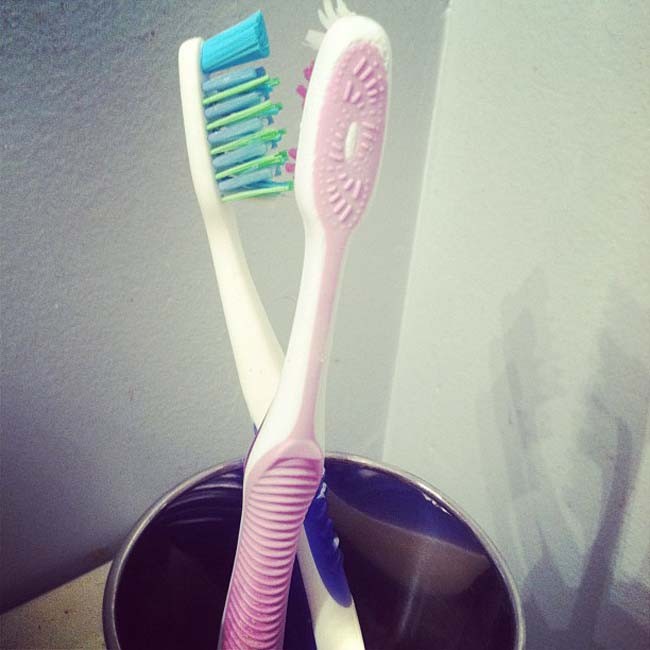
The width and height of the screenshot is (650, 650). Identify the location of pink toothbrush. (263, 489), (333, 151).